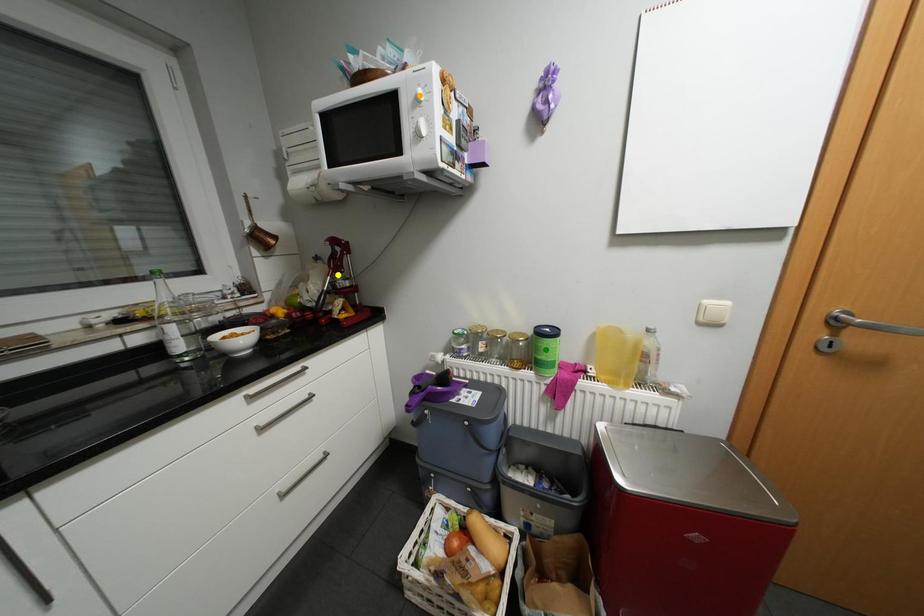
Order these from nearest to farthest:
- yellow point
- green point
- orange point

orange point
green point
yellow point